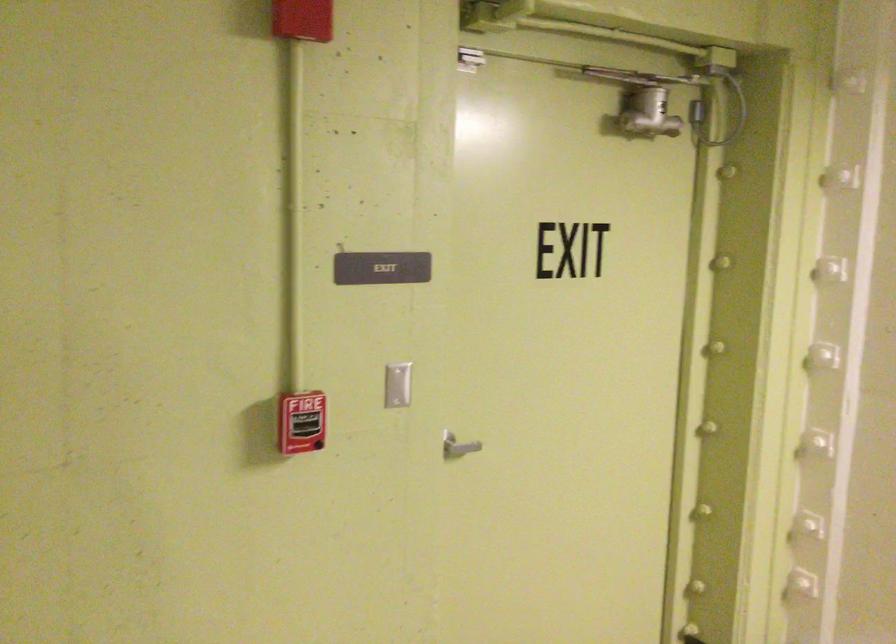
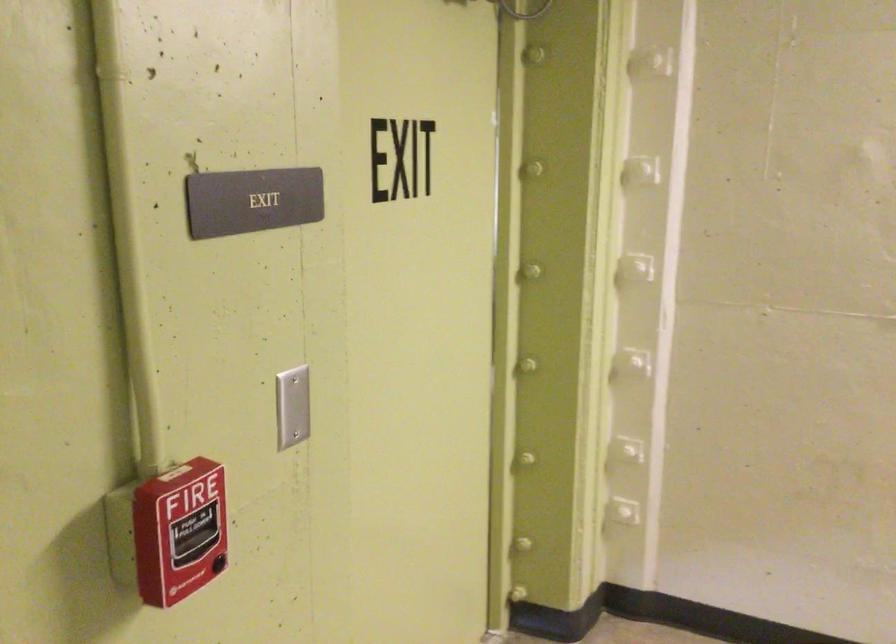
Locate, in the second image, the point that corresponds to [282,422] in the first image.

(179, 532)